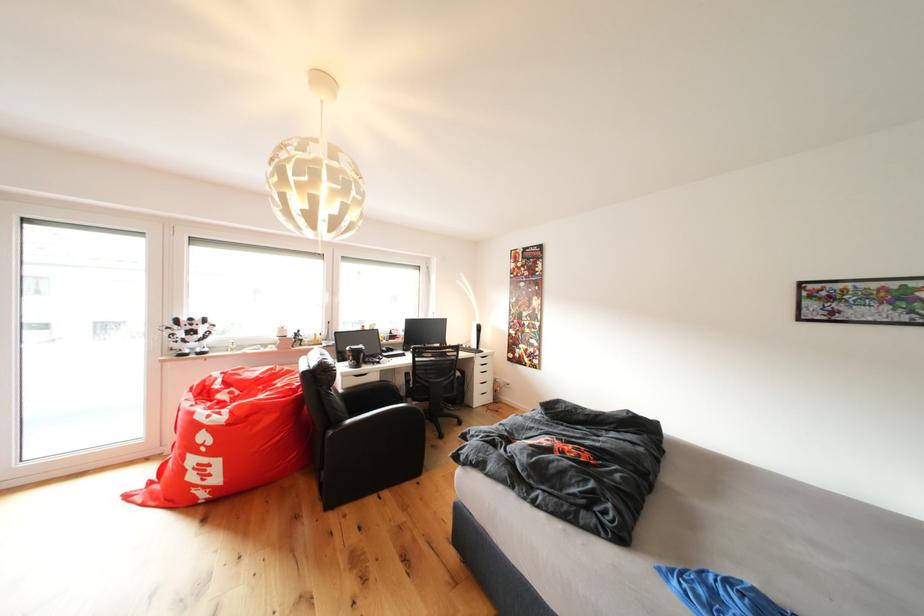
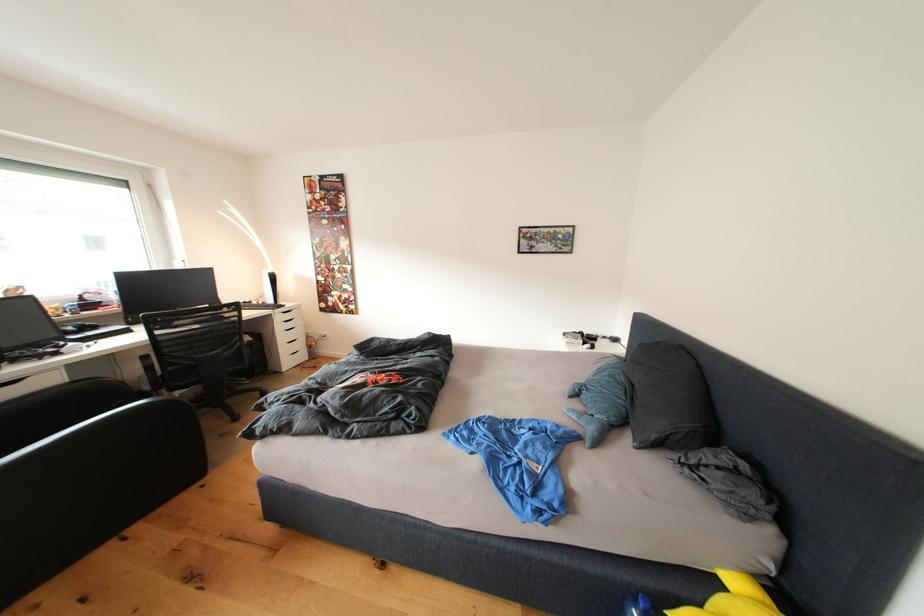
Question: The camera is either moving clockwise (left) or counter-clockwise (right) around the object. The first image is from the beginning of the video and the second image is from the end. Is the camera moving left or right when shooting the video?

Choices:
 (A) Left
 (B) Right

Answer: (A)